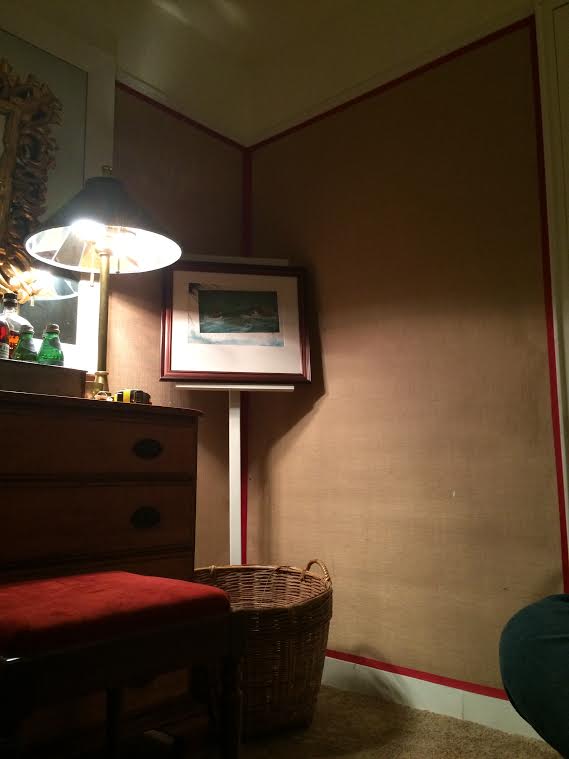
Where is `lamp`? The height and width of the screenshot is (759, 569). lamp is located at coordinates (123, 269).